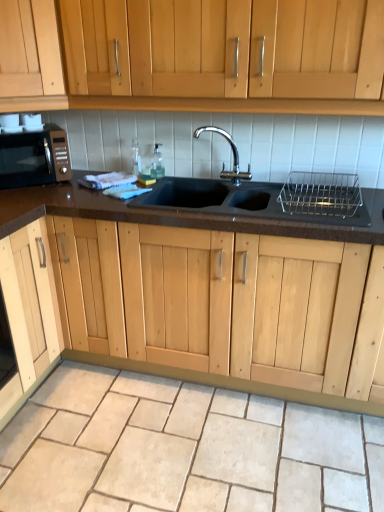
At what (x,y) coordinates should I click in order to perform the action: click on free space above beige stone granite at lower center (from a real-world perspective). Please return your answer as a coordinate pair (x, y). Looking at the image, I should click on (176, 436).